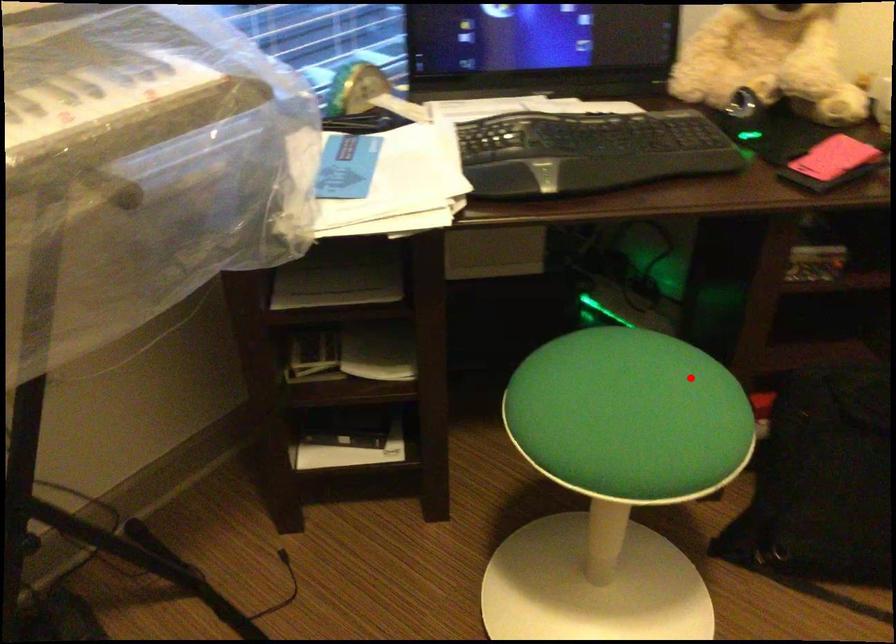
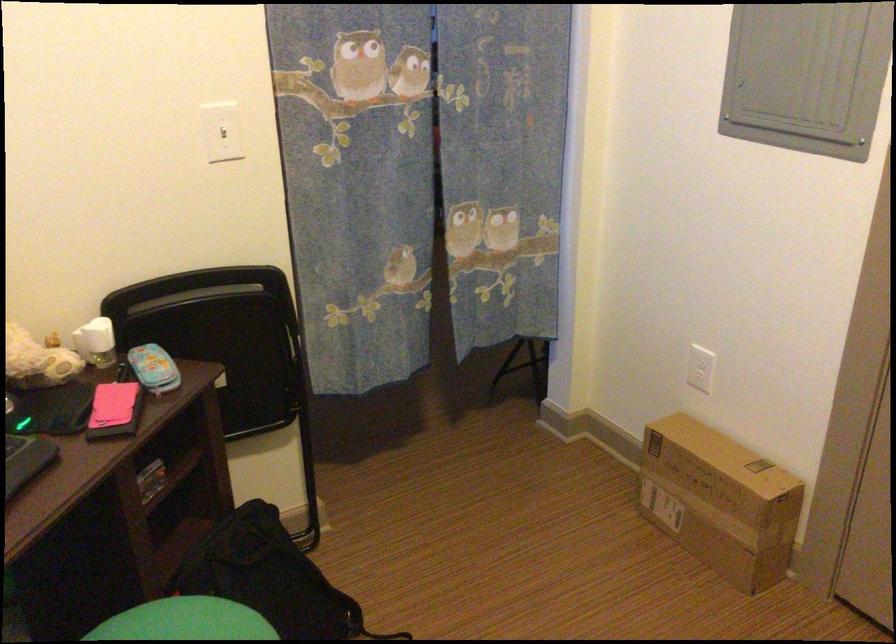
Question: I am providing you with two images of the same scene from different viewpoints. In image1, a red point is highlighted. Considering the same 3D point in image2, which of the following is correct?

Choices:
 (A) It is closer
 (B) It is farther

Answer: (B)